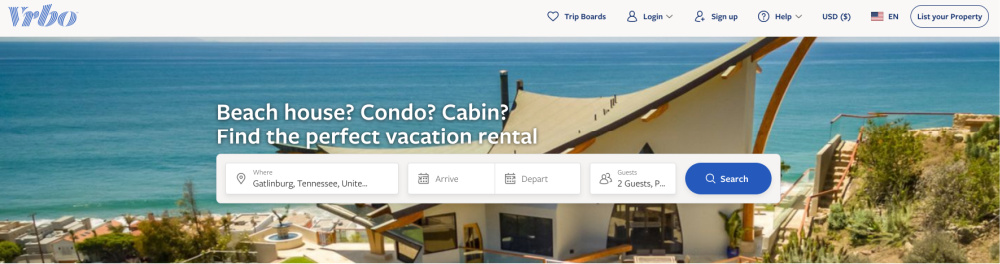
At what (x,y) coordinates should I click in order to perform the action: click on stairs. Please return your answer as a coordinate pair (x, y). The height and width of the screenshot is (264, 1000). Looking at the image, I should click on (839, 159).